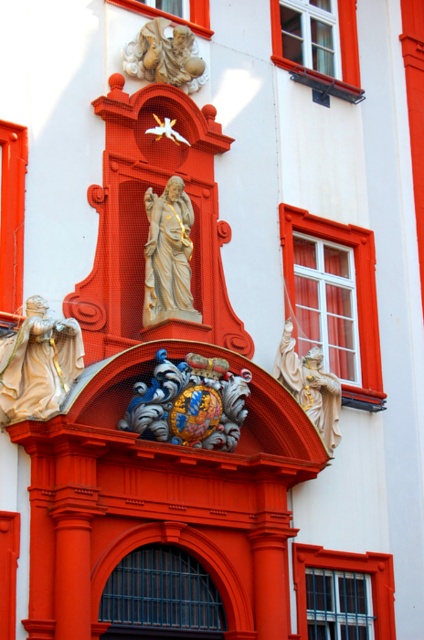
Does point (181, 54) lie in front of point (290, 387)?

No, (181, 54) is further to viewer.

Is carved stone cherub at upper center shorter than gold/gilded stone angel at center?

Indeed, carved stone cherub at upper center has a lesser height compared to gold/gilded stone angel at center.

Between point (173, 44) and point (320, 406), which one is positioned behind?

Point (173, 44)

I want to click on carved stone cherub at upper center, so [164, 54].

Between point (175, 227) and point (142, 51), which one is positioned in front?

Point (175, 227) is more forward.

Does matte gold statue at center have a lesser height compared to carved stone cherub at upper center?

No.

At what (x,y) coordinates should I click in order to perform the action: click on matte gold statue at center. Please return your answer as a coordinate pair (x, y). Looking at the image, I should click on (167, 253).

Who is more distant from viewer, (189, 410) or (158, 48)?

The point (158, 48) is more distant.

Describe the element at coordinates (189, 403) in the screenshot. I see `gold textured coat of arms at center` at that location.

Between point (212, 422) and point (159, 68), which one is positioned in front?

Point (212, 422) is in front.

The height and width of the screenshot is (640, 424). In order to click on gold textured coat of arms at center in this screenshot , I will do `click(189, 403)`.